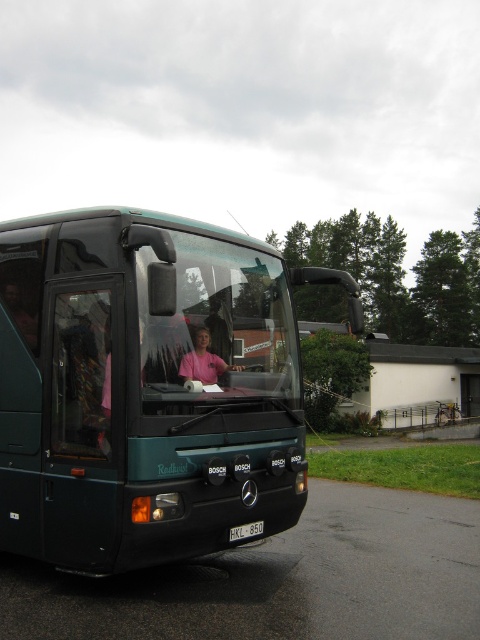
You are a passenger sitting in the back of the dark green Mercedes coach bus. You notice two items in front of you through the windshield. One is a pink matte shirt at center and the other is a black plastic license plate at center. Which one is positioned more to the left from your viewpoint?

The pink matte shirt at center is positioned to the left of the black plastic license plate at center, so the pink matte shirt at center is more to the left.

You are standing at the entrance of a parking lot and see the metallic green bus at center. If you walk straight towards the bus, will you reach it before reaching the parking lot exit located at point 0.5, 0.4?

The metallic green bus at center is located at point (x=145, y=387), which is closer to you than the parking lot exit at (x=192, y=320). Therefore, you will reach the metallic green bus at center before the exit.

You are a passenger on the metallic green bus at center and want to hand a note to the driver wearing the pink matte shirt at center. Which direction should you move to reach the driver?

The metallic green bus at center is to the left of the pink matte shirt at center, so you should move to your right to reach the driver wearing the pink matte shirt at center.